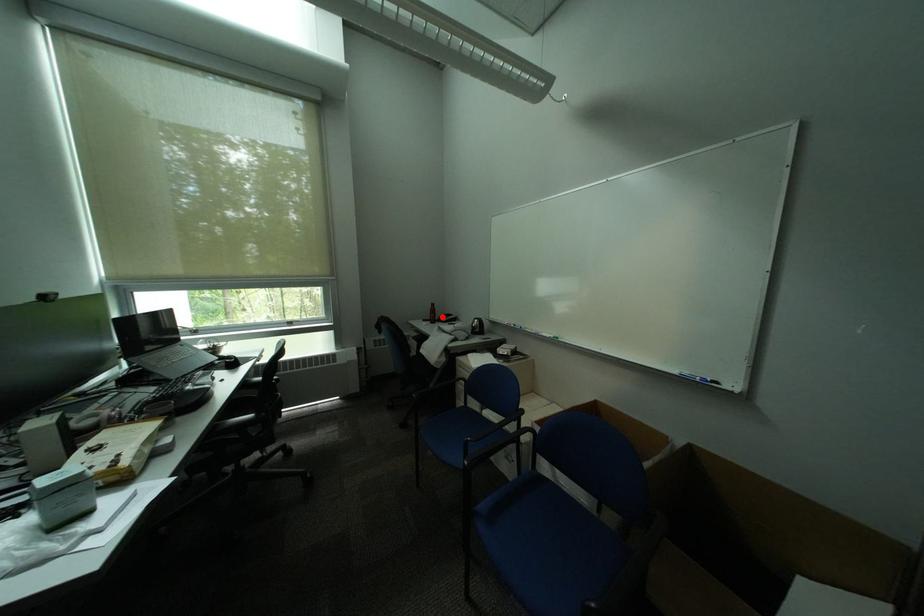
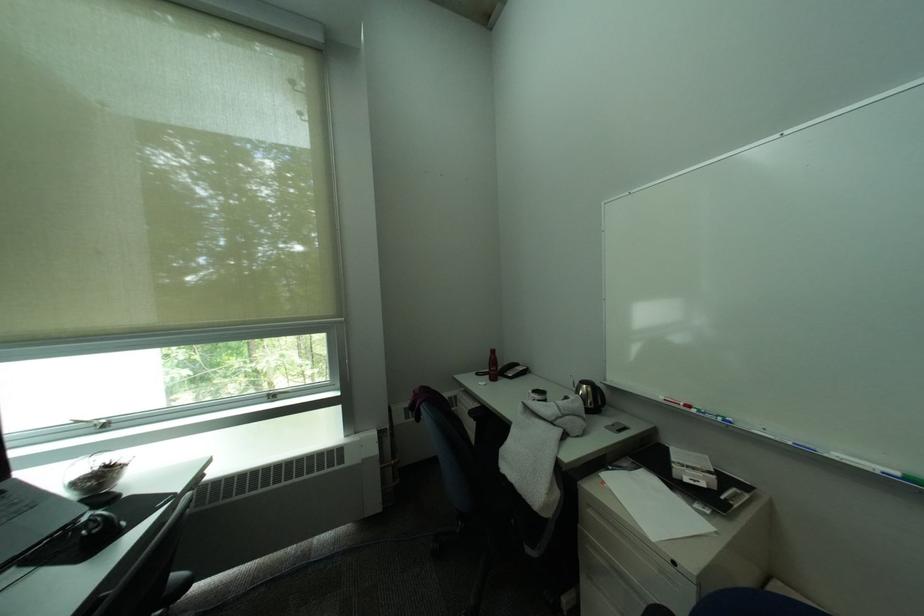
In the second image, find the point that corresponds to the highlighted location in the first image.

(503, 370)